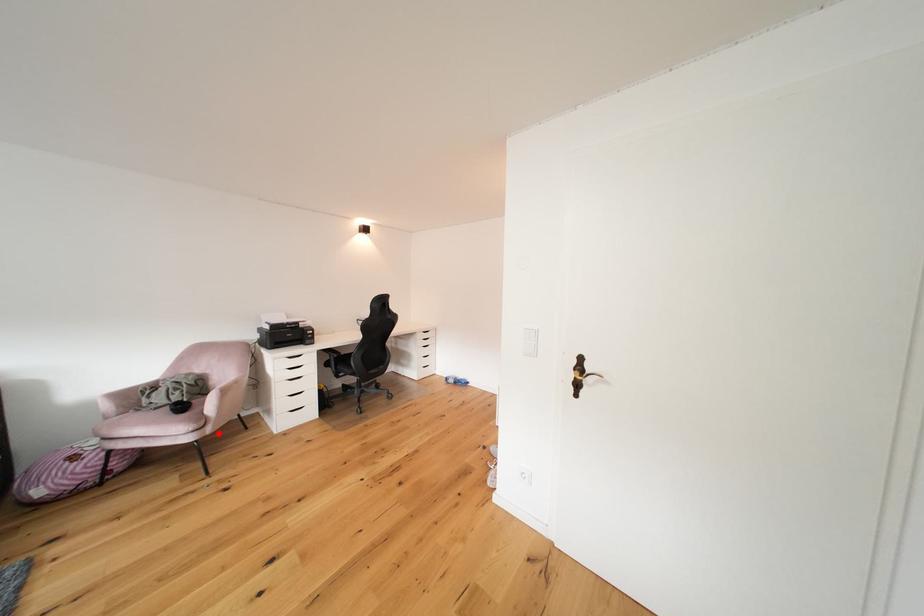
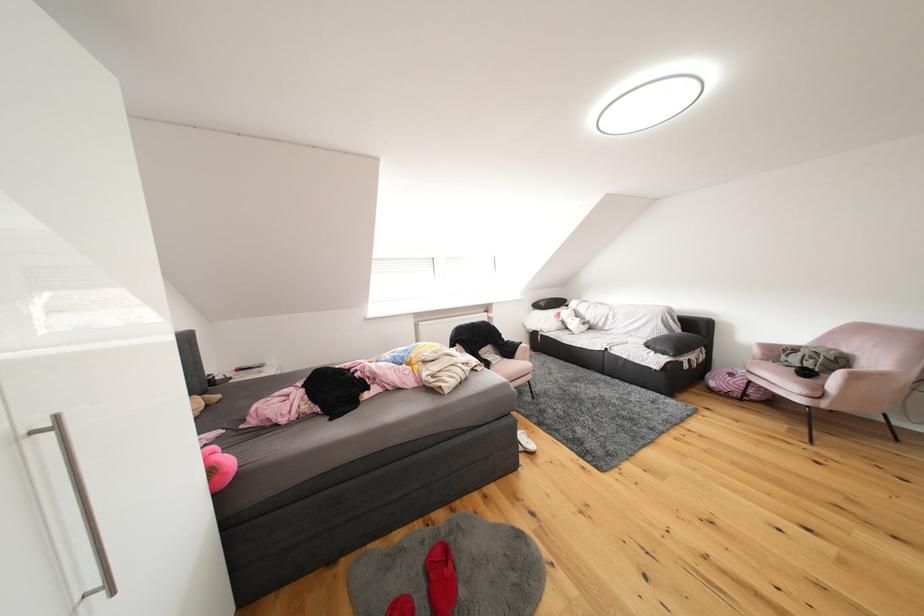
Find the pixel in the second image that matches the highlighted location in the first image.

(834, 408)